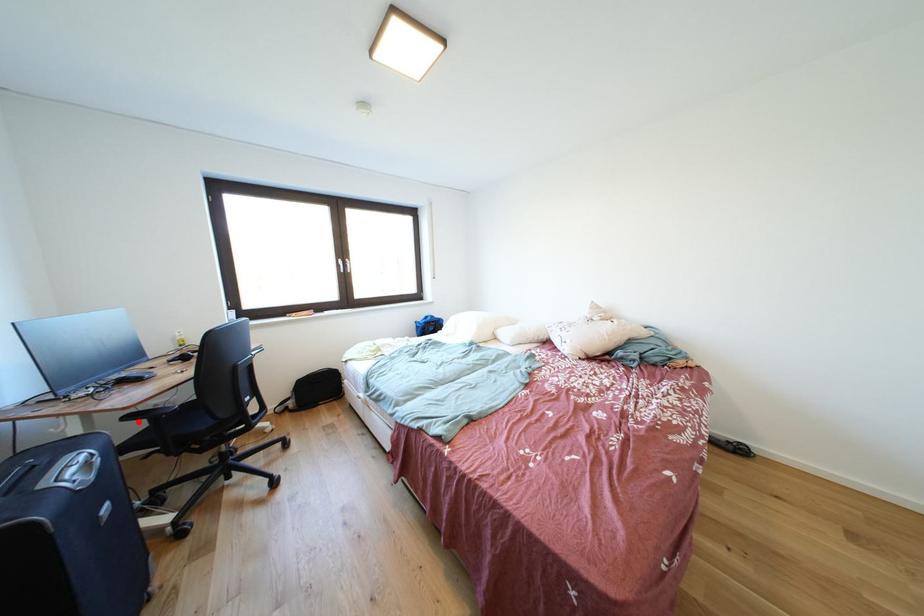
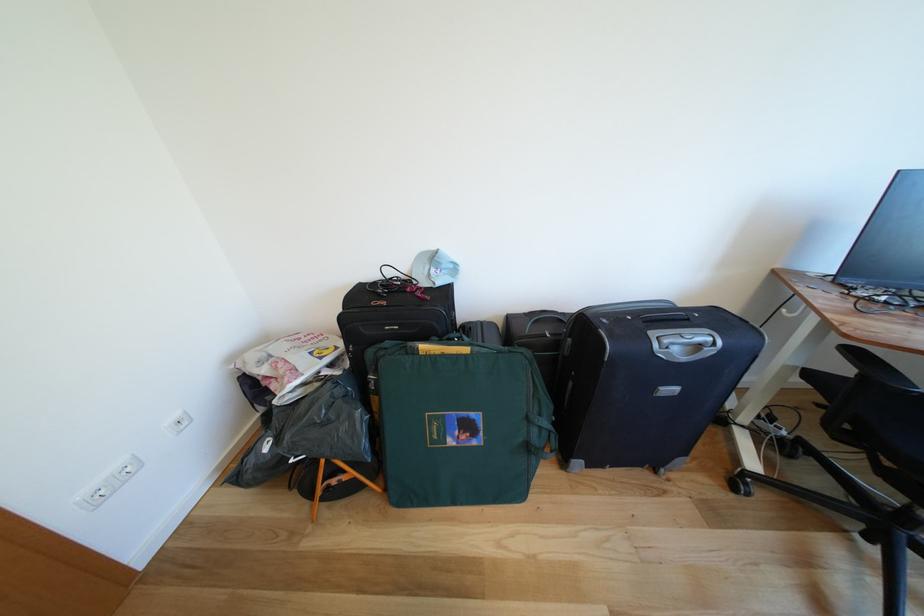
Question: I am providing you with two images of the same scene from different viewpoints. Given a red point in image1, look at the same physical point in image2. Is it:

Choices:
 (A) Closer to the viewpoint
 (B) Farther from the viewpoint

Answer: (B)